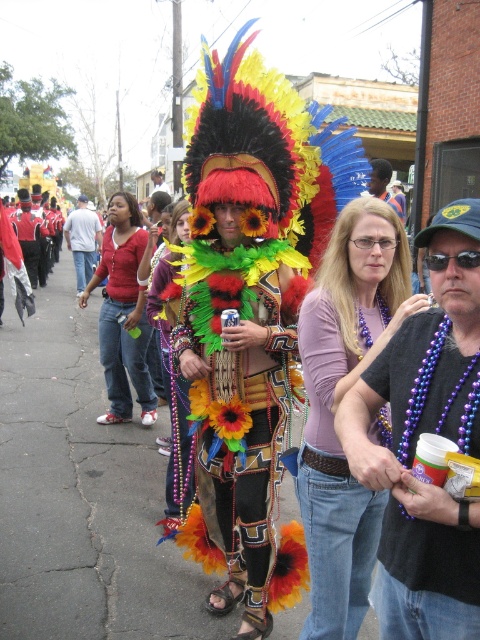
From the picture: Is matte red shirt at center to the right of matte black hat at center from the viewer's perspective?

No, matte red shirt at center is not to the right of matte black hat at center.

Does point (132, 278) come closer to viewer compared to point (381, 189)?

That is True.

Does point (113, 340) lie in front of point (387, 195)?

Yes, it is.

Find the location of a particular element. matte red shirt at center is located at coordinates pos(122,314).

Does purple beaded necklace at center have a smaller size compared to matte floral dress at center?

Actually, purple beaded necklace at center might be larger than matte floral dress at center.

Looking at this image, is purple beaded necklace at center wider than matte floral dress at center?

No.

Find the location of a particular element. The height and width of the screenshot is (640, 480). purple beaded necklace at center is located at coordinates (339, 401).

How far apart are matte red shirt at center and matte black shirt at center?

A distance of 8.41 meters exists between matte red shirt at center and matte black shirt at center.

Does point (130, 198) come in front of point (99, 234)?

Yes, point (130, 198) is closer to viewer.

The image size is (480, 640). Find the location of `matte red shirt at center`. matte red shirt at center is located at coordinates (122, 314).